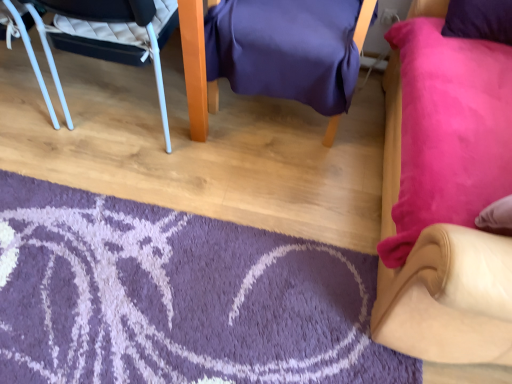
The height and width of the screenshot is (384, 512). I want to click on free space above purple shaggy rug at lower left (from a real-world perspective), so click(x=232, y=333).